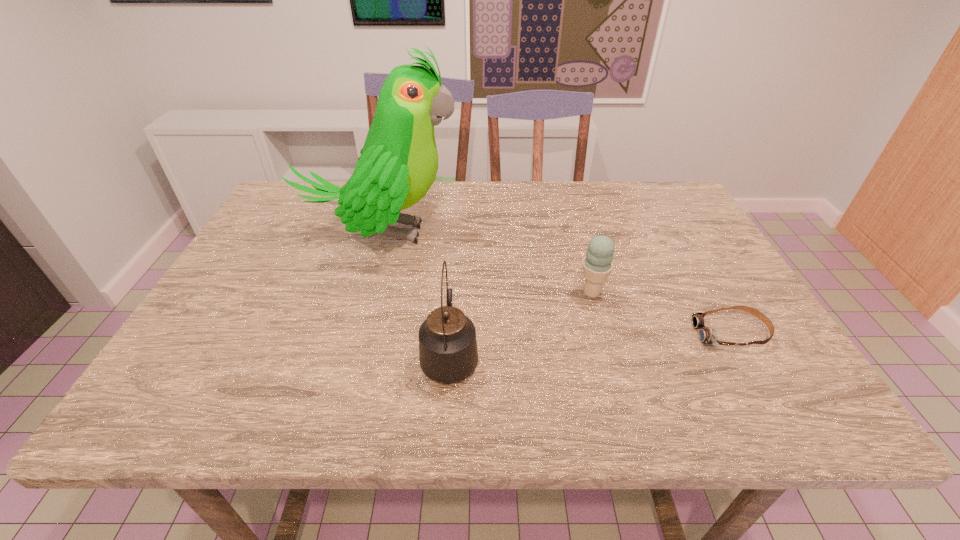
Locate an element on the screen. The height and width of the screenshot is (540, 960). the tallest object is located at coordinates (398, 164).

Locate an element on the screen. The height and width of the screenshot is (540, 960). the farthest object is located at coordinates (398, 164).

Where is `kettle`? kettle is located at coordinates (448, 353).

Locate an element on the screen. The height and width of the screenshot is (540, 960). ice cream is located at coordinates (598, 263).

The width and height of the screenshot is (960, 540). Identify the location of the second object from right to left. [598, 263].

The width and height of the screenshot is (960, 540). Identify the location of goggles. (706, 335).

The height and width of the screenshot is (540, 960). I want to click on the shortest object, so click(706, 335).

Locate an element on the screen. vacant area situated 0.060m on the beak of the farthest object is located at coordinates (481, 233).

At what (x,y) coordinates should I click in order to perform the action: click on vacant space located spout on the second tallest object. Please return your answer as a coordinate pair (x, y). Looking at the image, I should click on (457, 240).

In order to click on free space located spout on the second tallest object in this screenshot , I will do `click(458, 238)`.